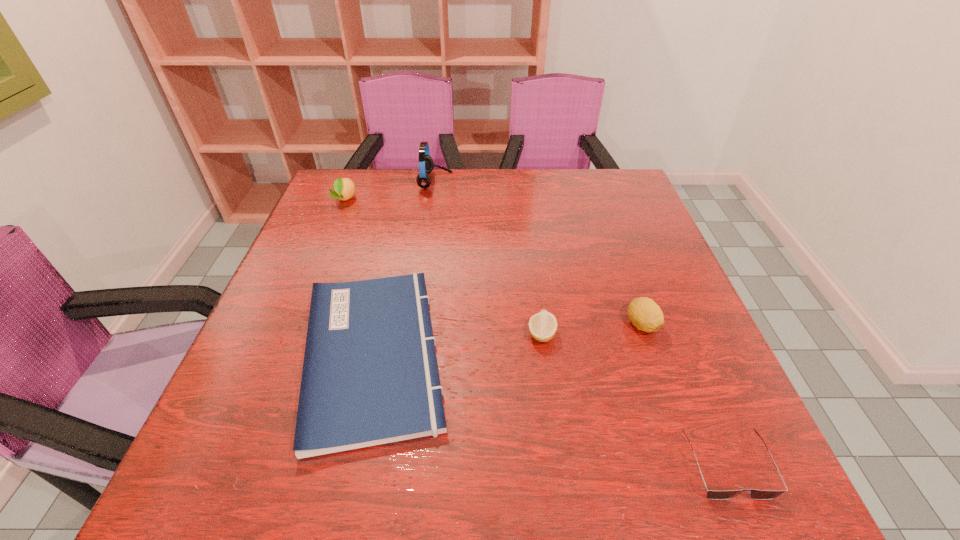
Where is `lemon that is the closest to the leftmost lemon`? This screenshot has height=540, width=960. lemon that is the closest to the leftmost lemon is located at coordinates (543, 325).

I want to click on lemon that is the third closest to the tallest object, so pyautogui.click(x=644, y=313).

I want to click on free location that satisfies the following two spatial constraints: 1. with leaves positioned above the leftmost lemon; 2. on the left side of the second lemon from right to left, so click(x=290, y=334).

You are a GUI agent. You are given a task and a screenshot of the screen. Output one action in this format:
    pyautogui.click(x=<x>, y=<y>)
    Task: Click on the vacant space that satisfies the following two spatial constraints: 1. on the back side of the paperback book; 2. on the right side of the second lemon from right to left
    The width and height of the screenshot is (960, 540).
    Given the screenshot: What is the action you would take?
    pyautogui.click(x=377, y=334)